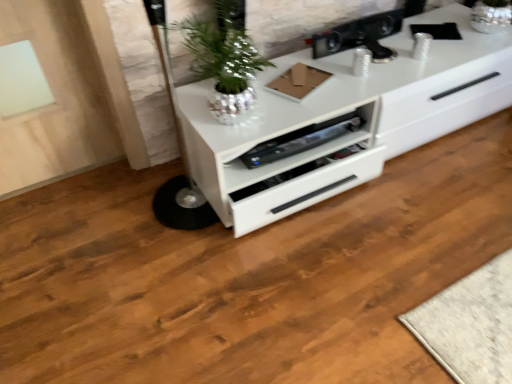
Find the location of a particular element. Image resolution: width=512 pixels, height=384 pixels. free space in front of white glossy chest of drawers at center is located at coordinates (367, 264).